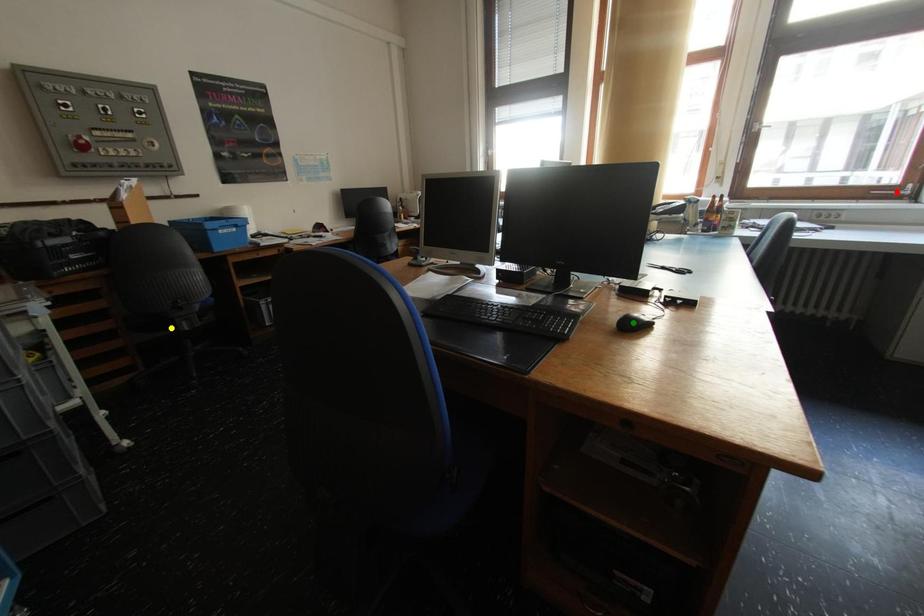
Order these from farthest to nearest:
- green point
- red point
- yellow point

red point → yellow point → green point